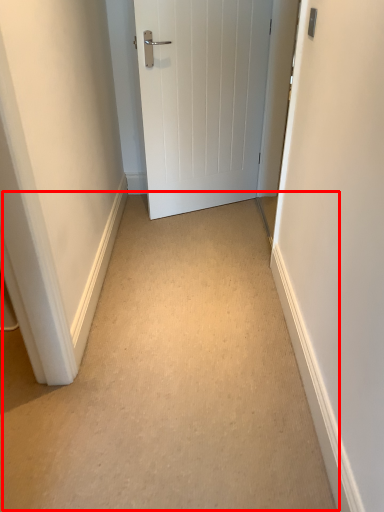
Question: In this image, where is path (annotated by the red box) located relative to door?

Choices:
 (A) left
 (B) right

Answer: (A)